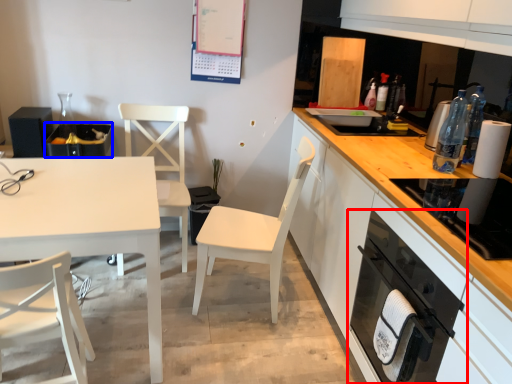
Question: Which of the following is the farthest to the observer, kitchen appliance (highlighted by a red box) or appliance (highlighted by a blue box)?

Choices:
 (A) kitchen appliance
 (B) appliance

Answer: (B)